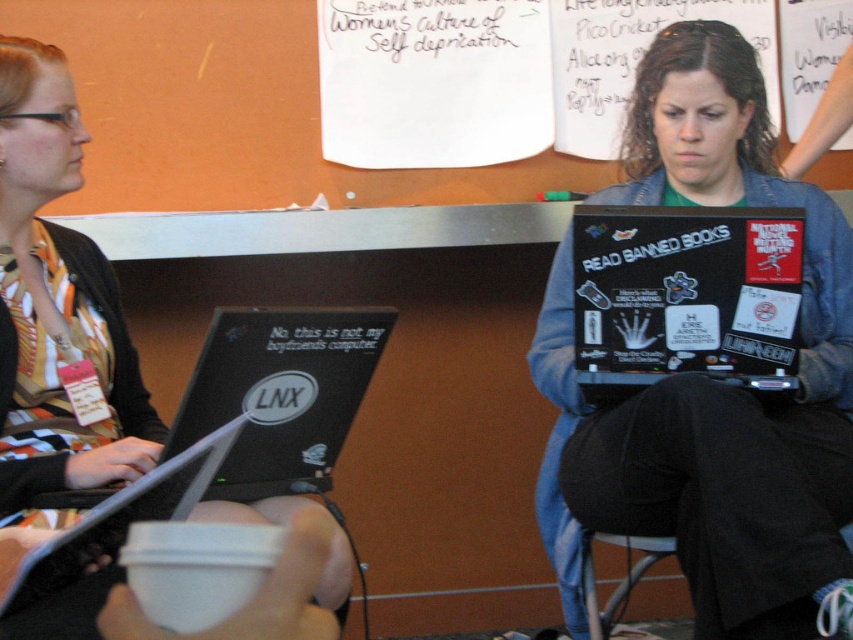
Does striped fabric shirt at left have a greater width compared to black matte laptop at lower left?

Yes, striped fabric shirt at left is wider than black matte laptop at lower left.

Can you confirm if striped fabric shirt at left is shorter than black matte laptop at lower left?

No, striped fabric shirt at left is not shorter than black matte laptop at lower left.

What do you see at coordinates (55, 314) in the screenshot?
I see `striped fabric shirt at left` at bounding box center [55, 314].

This screenshot has height=640, width=853. I want to click on striped fabric shirt at left, so click(55, 314).

Consider the image. Between black glossy laptop at center and black matte laptop at center, which one has more height?

black glossy laptop at center

Who is more forward, [842,524] or [798,308]?

Positioned in front is point [842,524].

You are a GUI agent. You are given a task and a screenshot of the screen. Output one action in this format:
    pyautogui.click(x=<x>, y=<y>)
    Task: Click on the black glossy laptop at center
    The image size is (853, 640).
    Given the screenshot: What is the action you would take?
    pyautogui.click(x=706, y=378)

Does white paper at upper center appear on the left side of black matte laptop at lower left?

Incorrect, white paper at upper center is not on the left side of black matte laptop at lower left.

The image size is (853, 640). Describe the element at coordinates (233, 113) in the screenshot. I see `white paper at upper center` at that location.

Locate an element on the screen. white paper at upper center is located at coordinates click(x=233, y=113).